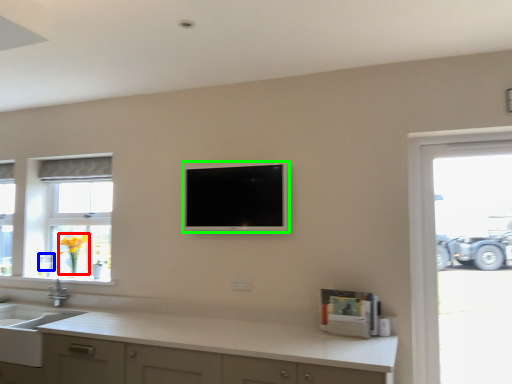
Question: Which is nearer to the flower (highlighted by a red box)? faucet (highlighted by a blue box) or television (highlighted by a green box).

Choices:
 (A) faucet
 (B) television

Answer: (A)